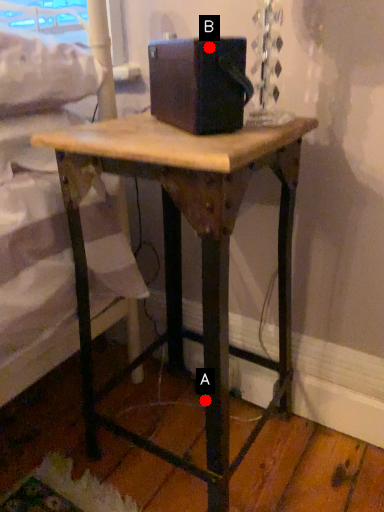
Question: Two points are circled on the image, labeled by A and B beside each circle. Which point is further to the camera?

Choices:
 (A) A is further
 (B) B is further

Answer: (A)